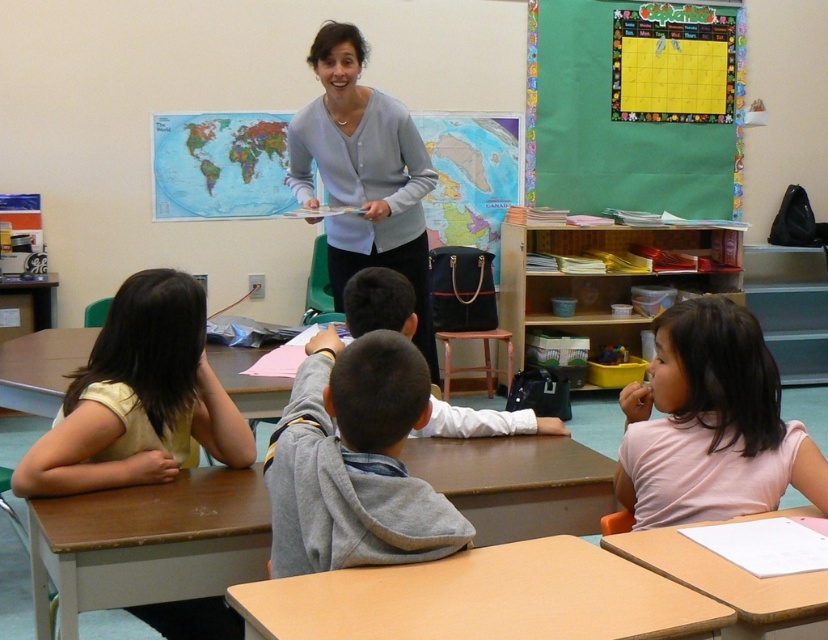
Can you confirm if light brown wooden table at center is smaller than gray fleece hoodie at center?

Indeed, light brown wooden table at center has a smaller size compared to gray fleece hoodie at center.

Is light brown wooden table at center in front of gray fleece hoodie at center?

Yes, it is.

At what (x,y) coordinates should I click in order to perform the action: click on light brown wooden table at center. Please return your answer as a coordinate pair (x, y). Looking at the image, I should click on (484, 598).

Find the location of a particular element. The height and width of the screenshot is (640, 828). light brown wooden table at center is located at coordinates (484, 598).

Is light yellow fabric shirt at left closer to camera compared to wooden desk at center?

That is False.

Does point (181, 611) lie in front of point (704, 573)?

No, it is not.

Locate an element on the screen. This screenshot has width=828, height=640. light yellow fabric shirt at left is located at coordinates (138, 397).

Does light yellow fabric shirt at left appear over matte gray sweater at center?

No, light yellow fabric shirt at left is not above matte gray sweater at center.

Does light yellow fabric shirt at left have a lesser height compared to matte gray sweater at center?

Yes.

Which is behind, point (171, 461) or point (364, 221)?

The point (364, 221) is more distant.

This screenshot has width=828, height=640. Identify the location of light yellow fabric shirt at left. (138, 397).